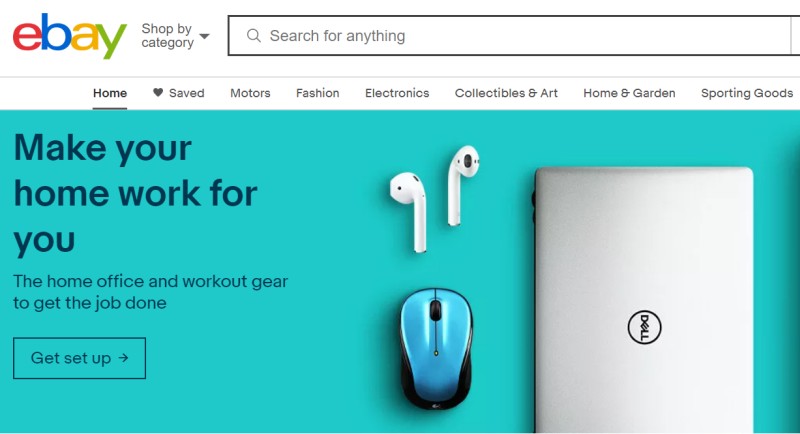
This screenshot has width=800, height=434. In order to click on mouse in this screenshot , I will do `click(430, 324)`.